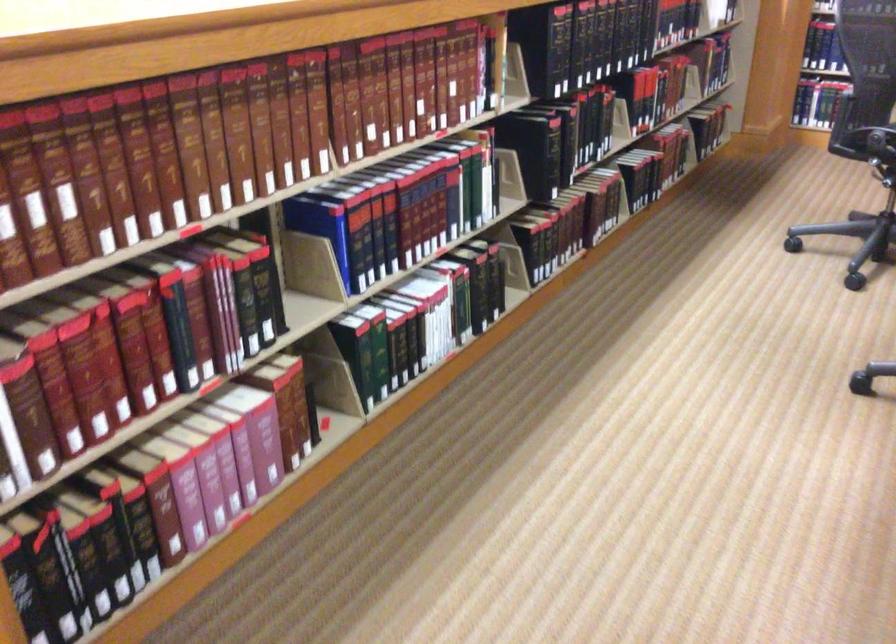
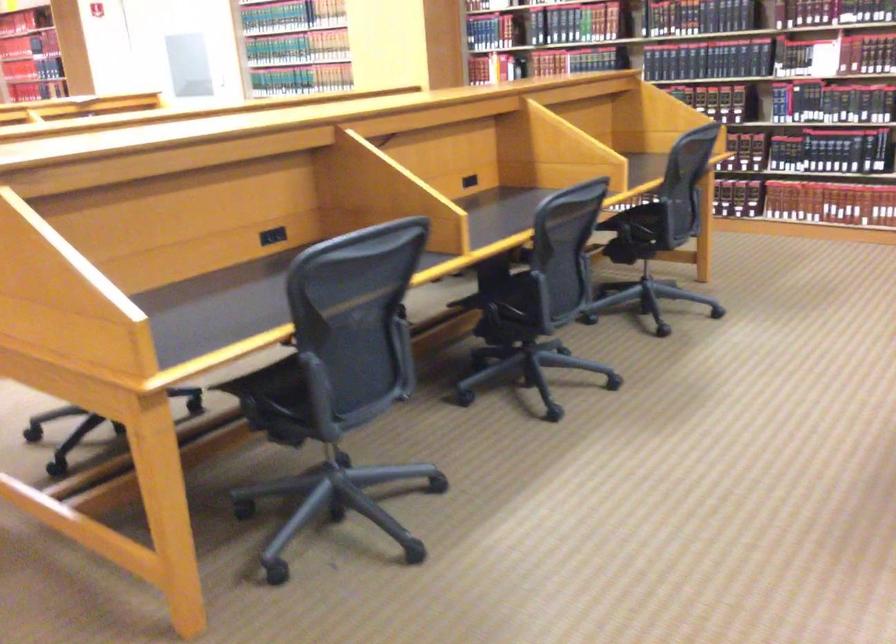
Question: I am providing you with two images of the same scene from different viewpoints. Which of the following objects are not visible in image2?

Choices:
 (A) chair sitting surface
 (B) black leather book
 (C) hardcover book
 (D) small trash can lid

Answer: (B)